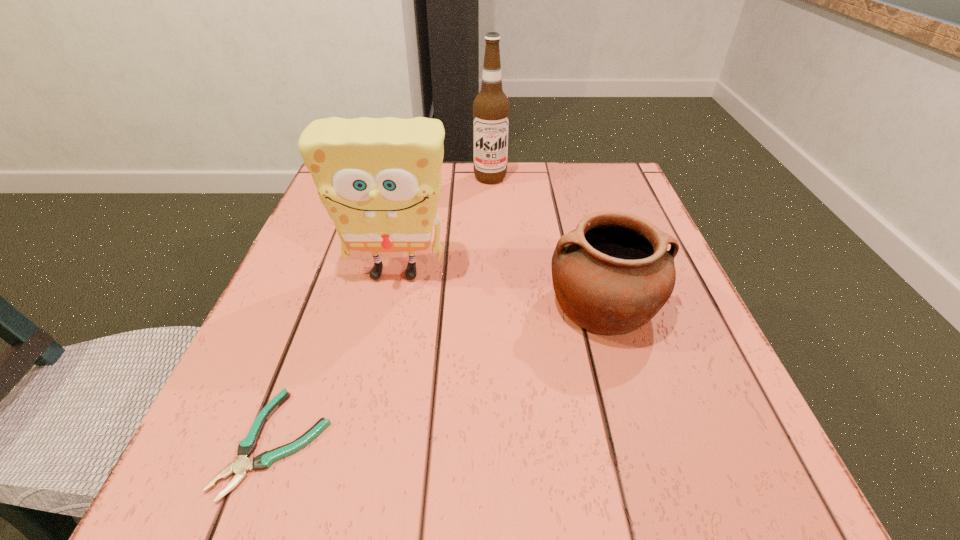
You are a GUI agent. You are given a task and a screenshot of the screen. Output one action in this format:
    pyautogui.click(x=<x>, y=<y>)
    Task: Click on the vacant area between the sponge and the farthest object
    Image resolution: width=960 pixels, height=540 pixels.
    Given the screenshot: What is the action you would take?
    pyautogui.click(x=443, y=225)

The height and width of the screenshot is (540, 960). Identify the location of free point between the nearest object and the third shortest object. (336, 357).

The width and height of the screenshot is (960, 540). Identify the location of vacant point located between the farthest object and the rightmost object. (546, 241).

Locate an element on the screen. This screenshot has height=540, width=960. object that is the closest to the sponge is located at coordinates (611, 275).

Choose which object is the nearest neighbor to the third object from left to right. Please provide its 2D coordinates. Your answer should be formatted as a tuple, i.e. [(x, y)], where the tuple contains the x and y coordinates of a point satisfying the conditions above.

[(379, 179)]

I want to click on vacant space that satisfies the following two spatial constraints: 1. on the back side of the rightmost object; 2. on the right side of the nearest object, so click(326, 304).

I want to click on free space in the image that satisfies the following two spatial constraints: 1. on the face of the third shortest object; 2. on the left side of the rightmost object, so click(x=388, y=304).

What are the coordinates of `free region that satisfies the following two spatial constraints: 1. on the back side of the shortest object; 2. on the left side of the rightmost object` in the screenshot? It's located at (326, 304).

Identify the location of vacant position in the image that satisfies the following two spatial constraints: 1. on the label of the second shortest object; 2. on the left side of the farthest object. (494, 304).

Locate an element on the screen. free spot that satisfies the following two spatial constraints: 1. on the face of the sponge; 2. on the right side of the pottery is located at coordinates pos(388,304).